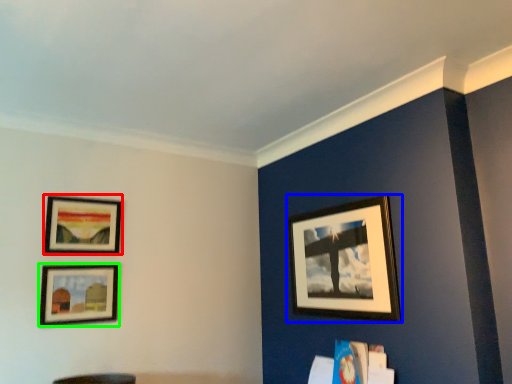
Question: Estimate the real-world distances between objects in this image. Which object is closer to picture frame (highlighted by a red box), picture frame (highlighted by a blue box) or picture frame (highlighted by a green box)?

Choices:
 (A) picture frame
 (B) picture frame

Answer: (B)